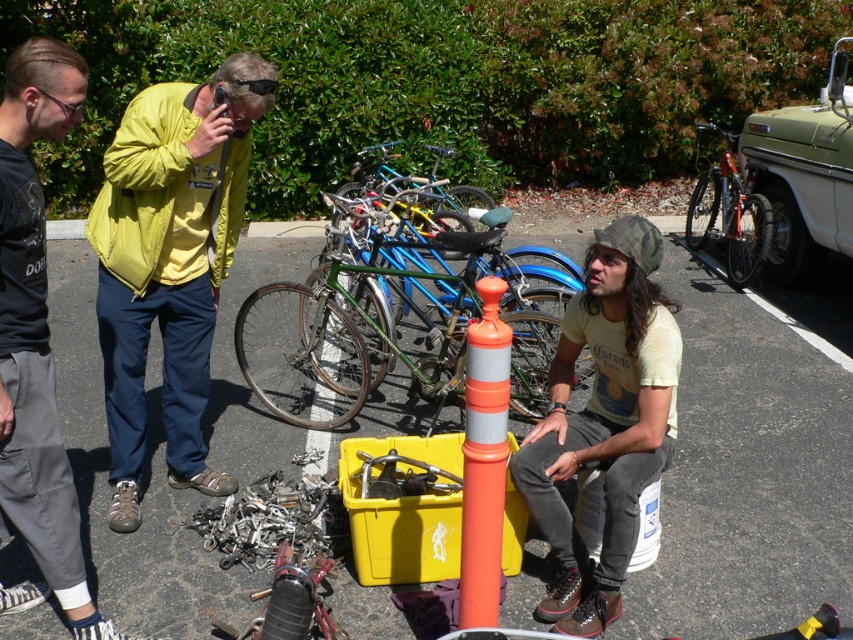
You are standing in the parking lot and want to walk from point A to point B. Point A is at coordinate point[554,628] and point B is at coordinate point[355,189]. Which point is closer to you when you start at point A?

Point A is at coordinate point[554,628] is closer to the viewer than point[355,189], so when you start at point A, point A is already your starting position and point B is further away.

You are navigating a small drone through the scene. You need to fly from point A at coordinates point (189, 440) to point B at coordinates point (467, 346). Will you pass over any objects between these two points?

Point (189, 440) is behind point (467, 346), so the drone will pass over point (467, 346) before reaching point (189, 440). Therefore, the drone will not pass over any objects between these points since point (467, 346) is in front of point (189, 440).

You are a delivery person who needs to place a package at point A, which is at coordinate point A at (604, 420). You see a camouflage fabric cap at center. Is there enough space to place the package there?

The camouflage fabric cap at center is located at point A at (604, 420), so placing the package there would require moving the cap first.